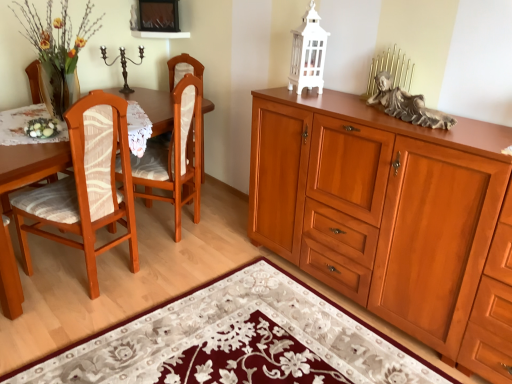
Question: Could you tell me if wooden chair at left, arranged as the 1th chair when viewed from the back, is facing gray stone statue at upper right?

Choices:
 (A) no
 (B) yes

Answer: (A)

Question: Would you say gray stone statue at upper right is part of wooden chair at left, arranged as the 1th chair when viewed from the back,'s contents?

Choices:
 (A) no
 (B) yes

Answer: (A)

Question: From a real-world perspective, does wooden chair at left, which is the 2th chair from front to back, stand above gray stone statue at upper right?

Choices:
 (A) no
 (B) yes

Answer: (A)

Question: From the image's perspective, is wooden chair at left, which is the 2th chair from front to back, below gray stone statue at upper right?

Choices:
 (A) no
 (B) yes

Answer: (B)

Question: Is wooden chair at left, which is the 2th chair from front to back, wider than gray stone statue at upper right?

Choices:
 (A) no
 (B) yes

Answer: (B)

Question: Is wooden chair at left, which is the 2th chair from front to back, positioned before gray stone statue at upper right?

Choices:
 (A) yes
 (B) no

Answer: (B)

Question: Is floral rug at lower center next to wooden cabinet at right and touching it?

Choices:
 (A) yes
 (B) no

Answer: (B)

Question: Does floral rug at lower center come behind wooden cabinet at right?

Choices:
 (A) yes
 (B) no

Answer: (B)

Question: From the image's perspective, would you say floral rug at lower center is positioned over wooden cabinet at right?

Choices:
 (A) yes
 (B) no

Answer: (B)

Question: Is floral rug at lower center smaller than wooden cabinet at right?

Choices:
 (A) no
 (B) yes

Answer: (B)

Question: From the image's perspective, is floral rug at lower center beneath wooden cabinet at right?

Choices:
 (A) yes
 (B) no

Answer: (A)

Question: Can you confirm if floral rug at lower center is taller than wooden cabinet at right?

Choices:
 (A) yes
 (B) no

Answer: (B)

Question: Is white lace tablecloth at left thinner than gray stone statue at upper right?

Choices:
 (A) no
 (B) yes

Answer: (A)